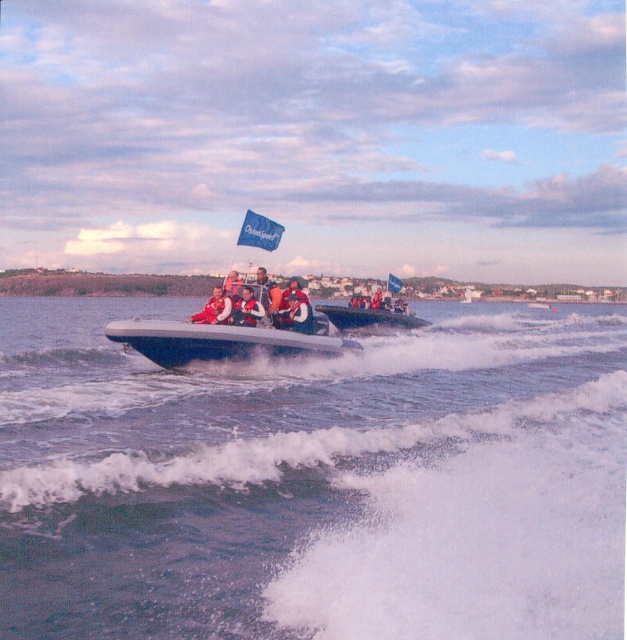
Question: Can you confirm if shiny blue boat at center is bigger than red life vest at center?

Choices:
 (A) yes
 (B) no

Answer: (A)

Question: Which object appears closest to the camera in this image?

Choices:
 (A) orange life jacket at center
 (B) shiny blue boat at center
 (C) red fabric life jacket at center

Answer: (A)

Question: Observing the image, what is the correct spatial positioning of red fabric life jacket at center in reference to orange life jacket at center?

Choices:
 (A) left
 (B) right

Answer: (B)

Question: Which of the following is the farthest from the observer?

Choices:
 (A) (218, 305)
 (B) (391, 275)

Answer: (B)

Question: Can you confirm if blue fabric flag at center is positioned to the right of red life vest at center?

Choices:
 (A) no
 (B) yes

Answer: (B)

Question: Considering the real-world distances, which object is closest to the blue fabric flag at center?

Choices:
 (A) shiny blue boat at center
 (B) orange life jacket at center
 (C) blue fabric flag at upper center
 (D) red life vest at center

Answer: (D)